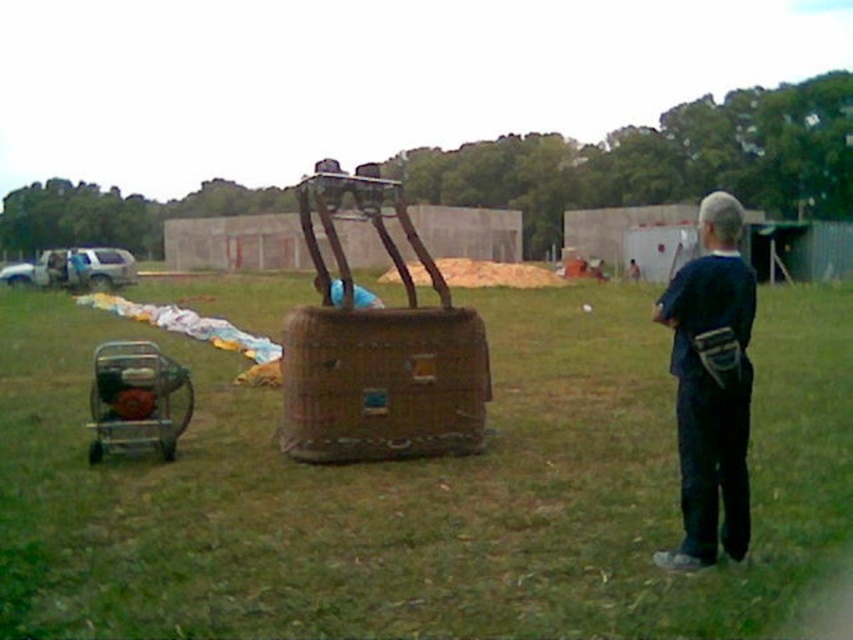
Can you confirm if brushed metal cart at lower left is positioned to the right of blue fabric at center?

No, brushed metal cart at lower left is not to the right of blue fabric at center.

Between point (177, 432) and point (317, 284), which one is positioned in front?

Point (177, 432) is in front.

At what (x,y) coordinates should I click in order to perform the action: click on brushed metal cart at lower left. Please return your answer as a coordinate pair (x, y). The image size is (853, 640). Looking at the image, I should click on (136, 400).

Is green grass at center bigger than blue fabric at center?

Yes.

Between point (10, 554) and point (361, 300), which one is positioned behind?

The point (361, 300) is behind.

The width and height of the screenshot is (853, 640). Find the location of `green grass at center`. green grass at center is located at coordinates (425, 490).

Between green grass at center and woven brown basket at center, which one is positioned higher?

green grass at center is higher up.

Who is more forward, (x=764, y=332) or (x=344, y=451)?

Point (x=344, y=451)

Where is `green grass at center`? green grass at center is located at coordinates (425, 490).